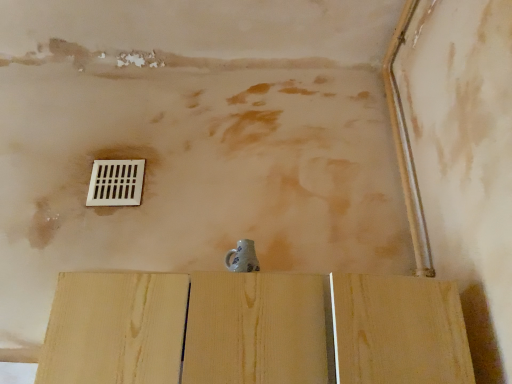
Question: Would you say natural wood plywood at center is inside or outside white plastic vent at upper center?

Choices:
 (A) inside
 (B) outside

Answer: (B)

Question: Looking at their shapes, would you say natural wood plywood at center is wider or thinner than white plastic vent at upper center?

Choices:
 (A) thin
 (B) wide

Answer: (B)

Question: In the image, is natural wood plywood at center positioned in front of or behind white plastic vent at upper center?

Choices:
 (A) behind
 (B) front

Answer: (B)

Question: Looking at the image, does white plastic vent at upper center seem bigger or smaller compared to natural wood plywood at center?

Choices:
 (A) big
 (B) small

Answer: (B)

Question: Would you say white plastic vent at upper center is to the left or to the right of natural wood plywood at center in the picture?

Choices:
 (A) left
 (B) right

Answer: (A)

Question: Is white plastic vent at upper center inside or outside of natural wood plywood at center?

Choices:
 (A) outside
 (B) inside

Answer: (A)

Question: From the image's perspective, is white plastic vent at upper center above or below natural wood plywood at center?

Choices:
 (A) below
 (B) above

Answer: (B)